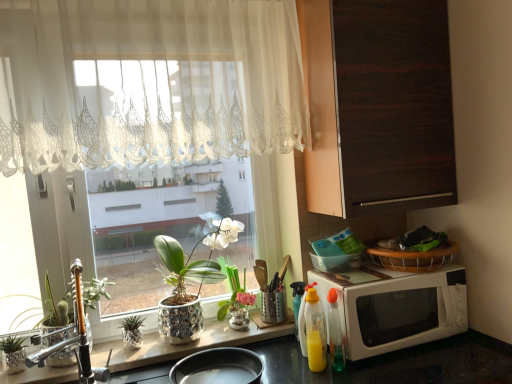
Describe the element at coordinates (132, 332) in the screenshot. Image resolution: width=512 pixels, height=384 pixels. I see `translucent glass pineapple at lower center, the 3th houseplant from the left` at that location.

What do you see at coordinates (234, 297) in the screenshot? I see `matte silver pot at center, the fifth houseplant from the left` at bounding box center [234, 297].

Describe the element at coordinates (148, 82) in the screenshot. This screenshot has width=512, height=384. I see `white lace curtain at upper left` at that location.

Image resolution: width=512 pixels, height=384 pixels. Describe the element at coordinates (378, 105) in the screenshot. I see `dark wood cabinet at upper right` at that location.

What do you see at coordinates (13, 354) in the screenshot?
I see `silver metallic pot at left, the fifth houseplant from the right` at bounding box center [13, 354].

Where is `translucent glass pineapple at lower center, the 3th houseplant in the right-to-left sequence`? The width and height of the screenshot is (512, 384). translucent glass pineapple at lower center, the 3th houseplant in the right-to-left sequence is located at coordinates (132, 332).

The height and width of the screenshot is (384, 512). I want to click on houseplant that is the 2nd object directly below the matte silver pot at center, the fifth houseplant from the left (from a real-world perspective), so click(13, 354).

Is silver metallic pot at left, the fifth houseplant from the right, closer to the viewer compared to matte silver pot at center, the fifth houseplant from the left?

Yes, it is.

Can we say silver metallic pot at left, which is the first houseplant in left-to-right order, lies outside matte silver pot at center, the fifth houseplant from the left?

silver metallic pot at left, which is the first houseplant in left-to-right order, lies outside matte silver pot at center, the fifth houseplant from the left,'s area.

In the image, is silver metallic pot at left, which is the first houseplant in left-to-right order, on the left side or the right side of matte silver pot at center, the fifth houseplant from the left?

silver metallic pot at left, which is the first houseplant in left-to-right order, is positioned on matte silver pot at center, the fifth houseplant from the left,'s left side.

Does translucent glass pineapple at lower center, the 3th houseplant from the left, have a lesser width compared to green metallic plant at left, placed as the second houseplant when sorted from left to right?

Yes, translucent glass pineapple at lower center, the 3th houseplant from the left, is thinner than green metallic plant at left, placed as the second houseplant when sorted from left to right.

Between point (132, 339) and point (89, 302), which one is positioned in front?

The point (132, 339) is more forward.

Which object is closer to the camera, translucent glass pineapple at lower center, the 3th houseplant from the left, or green metallic plant at left, the 4th houseplant viewed from the right?

Positioned in front is green metallic plant at left, the 4th houseplant viewed from the right.

Can you tell me how much translucent glass pineapple at lower center, the 3th houseplant in the right-to-left sequence, and green metallic plant at left, placed as the second houseplant when sorted from left to right, differ in facing direction?

0.000123 degrees separate the facing orientations of translucent glass pineapple at lower center, the 3th houseplant in the right-to-left sequence, and green metallic plant at left, placed as the second houseplant when sorted from left to right.

From the image's perspective, which object appears higher, yellow translucent bottle at lower right, which appears as the 4th bottle when viewed from the back, or silver textured pot at center, the 2th houseplant viewed from the right?

From the image's view, silver textured pot at center, the 2th houseplant viewed from the right, is above.

Is silver textured pot at center, the 2th houseplant viewed from the right, at the back of yellow translucent bottle at lower right, placed as the first bottle when sorted from front to back?

No, yellow translucent bottle at lower right, placed as the first bottle when sorted from front to back, is not facing the opposite direction of silver textured pot at center, the 2th houseplant viewed from the right.

Can you confirm if yellow translucent bottle at lower right, placed as the first bottle when sorted from front to back, is taller than silver textured pot at center, the 2th houseplant viewed from the right?

No, yellow translucent bottle at lower right, placed as the first bottle when sorted from front to back, is not taller than silver textured pot at center, the 2th houseplant viewed from the right.

Is white glossy microwave at right in front of or behind yellow plastic bottle at lower center, which ranks as the 2th bottle in back-to-front order, in the image?

white glossy microwave at right is in front of yellow plastic bottle at lower center, which ranks as the 2th bottle in back-to-front order.

From the image's perspective, which one is positioned lower, white glossy microwave at right or yellow plastic bottle at lower center, which ranks as the 2th bottle in back-to-front order?

From the image's view, yellow plastic bottle at lower center, which ranks as the 2th bottle in back-to-front order, is below.

From the picture: How much distance is there between white glossy microwave at right and yellow plastic bottle at lower center, which is counted as the third bottle, starting from the front?

white glossy microwave at right is 12.76 inches away from yellow plastic bottle at lower center, which is counted as the third bottle, starting from the front.

From a real-world perspective, does white glossy microwave at right sit lower than yellow plastic bottle at lower center, which is counted as the third bottle, starting from the front?

Actually, white glossy microwave at right is physically above yellow plastic bottle at lower center, which is counted as the third bottle, starting from the front, in the real world.

Considering the relative sizes of translucent plastic bottle at lower right, which appears as the 2th bottle when viewed from the front, and silver textured pot at center, the 2th houseplant viewed from the right, in the image provided, is translucent plastic bottle at lower right, which appears as the 2th bottle when viewed from the front, shorter than silver textured pot at center, the 2th houseplant viewed from the right,?

Yes.

Can you confirm if translucent plastic bottle at lower right, which is counted as the third bottle, starting from the back, is smaller than silver textured pot at center, the 4th houseplant positioned from the left?

Indeed, translucent plastic bottle at lower right, which is counted as the third bottle, starting from the back, has a smaller size compared to silver textured pot at center, the 4th houseplant positioned from the left.

Measure the distance between translucent plastic bottle at lower right, which is counted as the third bottle, starting from the back, and silver textured pot at center, the 4th houseplant positioned from the left.

translucent plastic bottle at lower right, which is counted as the third bottle, starting from the back, and silver textured pot at center, the 4th houseplant positioned from the left, are 60.37 centimeters apart from each other.

Is translucent plastic bottle at lower right, which is counted as the third bottle, starting from the back, to the right of silver textured pot at center, the 4th houseplant positioned from the left, from the viewer's perspective?

Yes, translucent plastic bottle at lower right, which is counted as the third bottle, starting from the back, is to the right of silver textured pot at center, the 4th houseplant positioned from the left.

Would you consider silver metallic pot at left, which is the first houseplant in left-to-right order, to be distant from dark wood cabinet at upper right?

silver metallic pot at left, which is the first houseplant in left-to-right order, is far away from dark wood cabinet at upper right.

Considering the relative sizes of silver metallic pot at left, which is the first houseplant in left-to-right order, and dark wood cabinet at upper right in the image provided, is silver metallic pot at left, which is the first houseplant in left-to-right order, wider than dark wood cabinet at upper right?

No.

From the picture: Is silver metallic pot at left, which is the first houseplant in left-to-right order, smaller than dark wood cabinet at upper right?

Yes, silver metallic pot at left, which is the first houseplant in left-to-right order, is smaller than dark wood cabinet at upper right.

You are a GUI agent. You are given a task and a screenshot of the screen. Output one action in this format:
    pyautogui.click(x=<x>, y=<y>)
    Task: Click on the cabinetry on the right of silver metallic pot at left, which is the first houseplant in left-to-right order
    
    Given the screenshot: What is the action you would take?
    pyautogui.click(x=378, y=105)

Does point (303, 306) lie behind point (218, 310)?

That is False.

Can we say yellow plastic bottle at lower center, which is counted as the third bottle, starting from the front, lies outside matte silver pot at center, the fifth houseplant from the left?

Yes, yellow plastic bottle at lower center, which is counted as the third bottle, starting from the front, is located beyond the bounds of matte silver pot at center, the fifth houseplant from the left.

Is yellow plastic bottle at lower center, which ranks as the 2th bottle in back-to-front order, not near matte silver pot at center, the fifth houseplant from the left?

No, yellow plastic bottle at lower center, which ranks as the 2th bottle in back-to-front order, is not far from matte silver pot at center, the fifth houseplant from the left.

Which houseplant is the 3rd one when counting from the back of the silver metallic pot at left, which is the first houseplant in left-to-right order? Please provide its 2D coordinates.

[(234, 297)]

You are a GUI agent. You are given a task and a screenshot of the screen. Output one action in this format:
    pyautogui.click(x=<x>, y=<y>)
    Task: Click on the houseplant that is the 1st object located above the translucent glass pineapple at lower center, the 3th houseplant from the left (from the image's perspective)
    
    Given the screenshot: What is the action you would take?
    pyautogui.click(x=73, y=329)

When comparing their distances from yellow translucent spray bottle at center, which is the 4th bottle in front-to-back order, does white glossy microwave at right or white lace curtain at upper left seem further?

The object further to yellow translucent spray bottle at center, which is the 4th bottle in front-to-back order, is white lace curtain at upper left.

Considering their positions, is yellow translucent spray bottle at center, the 1th bottle viewed from the back, positioned closer to yellow translucent bottle at lower right, which appears as the 4th bottle when viewed from the back, than translucent glass pineapple at lower center, the 3th houseplant from the left?

yellow translucent spray bottle at center, the 1th bottle viewed from the back, is positioned closer to the anchor yellow translucent bottle at lower right, which appears as the 4th bottle when viewed from the back.

From the image, which object appears to be nearer to matte silver pot at center, the 1th houseplant when ordered from right to left, translucent glass pineapple at lower center, the 3th houseplant in the right-to-left sequence, or silver textured pot at center, the 2th houseplant viewed from the right?

Based on the image, silver textured pot at center, the 2th houseplant viewed from the right, appears to be nearer to matte silver pot at center, the 1th houseplant when ordered from right to left.

Estimate the real-world distances between objects in this image. Which object is closer to translucent plastic bottle at lower right, which is counted as the third bottle, starting from the back, yellow plastic bottle at lower center, which ranks as the 2th bottle in back-to-front order, or silver textured pot at center, the 2th houseplant viewed from the right?

yellow plastic bottle at lower center, which ranks as the 2th bottle in back-to-front order, is positioned closer to the anchor translucent plastic bottle at lower right, which is counted as the third bottle, starting from the back.

Consider the image. Which object lies nearer to the anchor point translucent glass pineapple at lower center, the 3th houseplant in the right-to-left sequence, yellow translucent bottle at lower right, placed as the first bottle when sorted from front to back, or green metallic plant at left, the 4th houseplant viewed from the right?

green metallic plant at left, the 4th houseplant viewed from the right, is closer to translucent glass pineapple at lower center, the 3th houseplant in the right-to-left sequence.

Based on their spatial positions, is translucent glass pineapple at lower center, the 3th houseplant in the right-to-left sequence, or green metallic plant at left, placed as the second houseplant when sorted from left to right, closer to yellow translucent spray bottle at center, the 1th bottle viewed from the back?

translucent glass pineapple at lower center, the 3th houseplant in the right-to-left sequence, lies closer to yellow translucent spray bottle at center, the 1th bottle viewed from the back, than the other object.

Looking at the image, which one is located closer to dark wood cabinet at upper right, silver textured pot at center, the 4th houseplant positioned from the left, or white lace curtain at upper left?

The object closer to dark wood cabinet at upper right is white lace curtain at upper left.

When comparing their distances from white glossy microwave at right, does silver metallic pot at left, which is the first houseplant in left-to-right order, or silver textured pot at center, the 4th houseplant positioned from the left, seem further?

The object further to white glossy microwave at right is silver metallic pot at left, which is the first houseplant in left-to-right order.

Locate an element on the screen. The width and height of the screenshot is (512, 384). cabinetry between white lace curtain at upper left and white glossy microwave at right vertically is located at coordinates (378, 105).

Where is `cabinetry between white lace curtain at upper left and yellow translucent spray bottle at center, the 1th bottle viewed from the back, from top to bottom`? cabinetry between white lace curtain at upper left and yellow translucent spray bottle at center, the 1th bottle viewed from the back, from top to bottom is located at coordinates pyautogui.click(x=378, y=105).

I want to click on counter top between silver metallic pot at left, the fifth houseplant from the right, and translucent plastic bottle at lower right, which is counted as the third bottle, starting from the back, from left to right, so click(x=182, y=345).

Where is `counter top between translucent glass pineapple at lower center, the 3th houseplant from the left, and translucent plastic bottle at lower right, which appears as the 2th bottle when viewed from the front`? The image size is (512, 384). counter top between translucent glass pineapple at lower center, the 3th houseplant from the left, and translucent plastic bottle at lower right, which appears as the 2th bottle when viewed from the front is located at coordinates (182, 345).